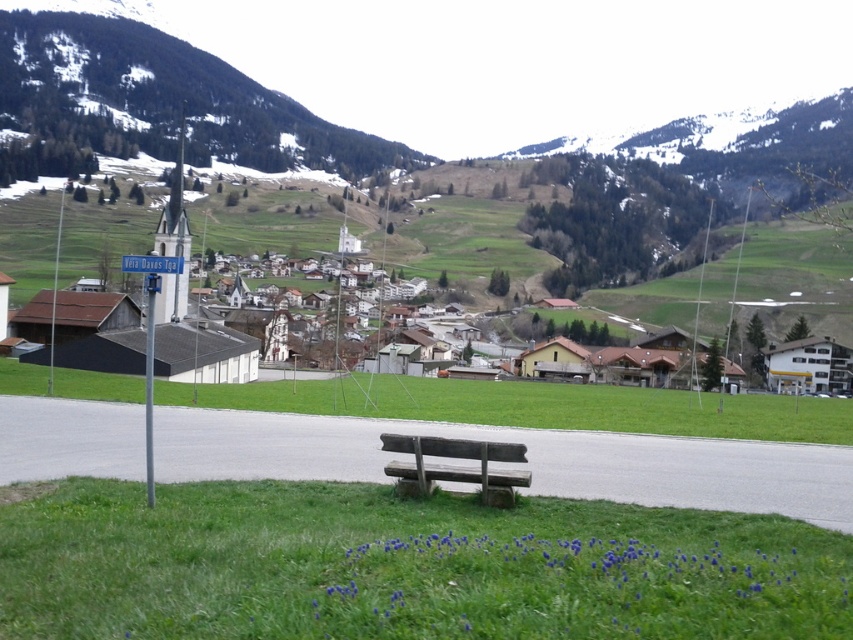
Which is in front, point (51, 604) or point (460, 385)?

Positioned in front is point (51, 604).

Which is in front, point (543, 632) or point (790, 416)?

Point (543, 632) is more forward.

Where is `green grass at lower center`? This screenshot has width=853, height=640. green grass at lower center is located at coordinates (404, 566).

Does green grass at lower center have a greater width compared to snowy rocky mountain at upper left?

Incorrect, green grass at lower center's width does not surpass snowy rocky mountain at upper left's.

Is green grass at lower center bigger than snowy rocky mountain at upper left?

No, green grass at lower center is not bigger than snowy rocky mountain at upper left.

What do you see at coordinates (404, 566) in the screenshot? This screenshot has width=853, height=640. I see `green grass at lower center` at bounding box center [404, 566].

Image resolution: width=853 pixels, height=640 pixels. In order to click on green grass at lower center in this screenshot , I will do `click(404, 566)`.

Which of these two, green grass at center or wooden bench at center, stands shorter?

wooden bench at center is shorter.

Between point (721, 413) and point (473, 445), which one is positioned in front?

Point (473, 445)

I want to click on green grass at center, so click(549, 406).